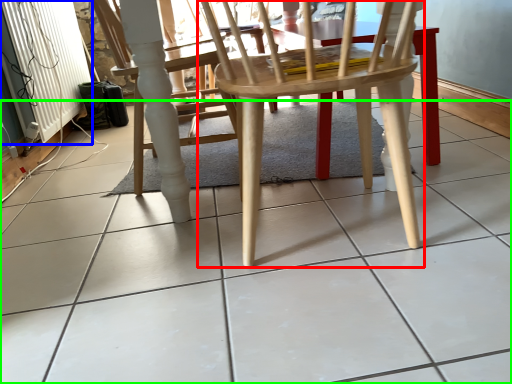
Question: Based on their relative distances, which object is farther from chair (highlighted by a red box)? Choose from radiator (highlighted by a blue box) and ceramic tile (highlighted by a green box).

Choices:
 (A) radiator
 (B) ceramic tile

Answer: (A)